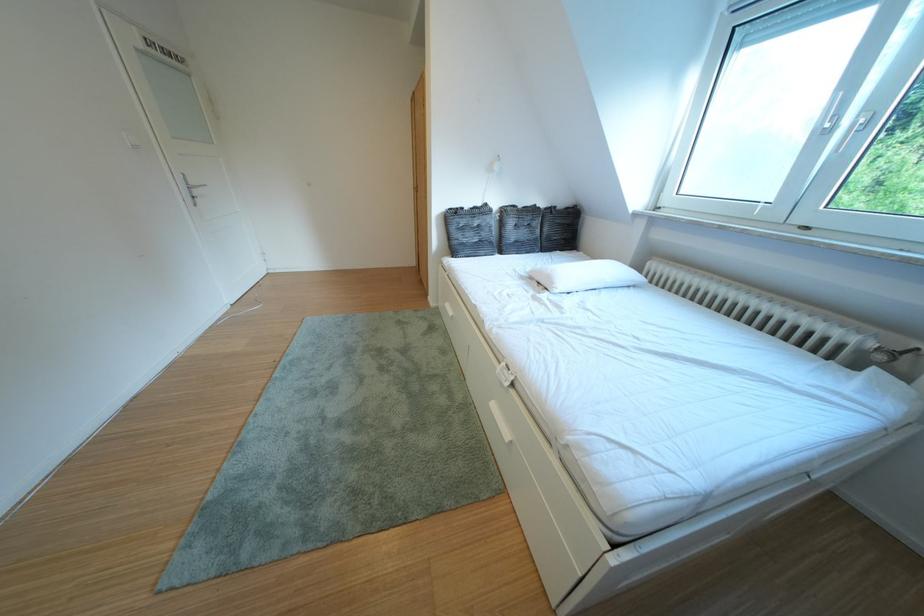
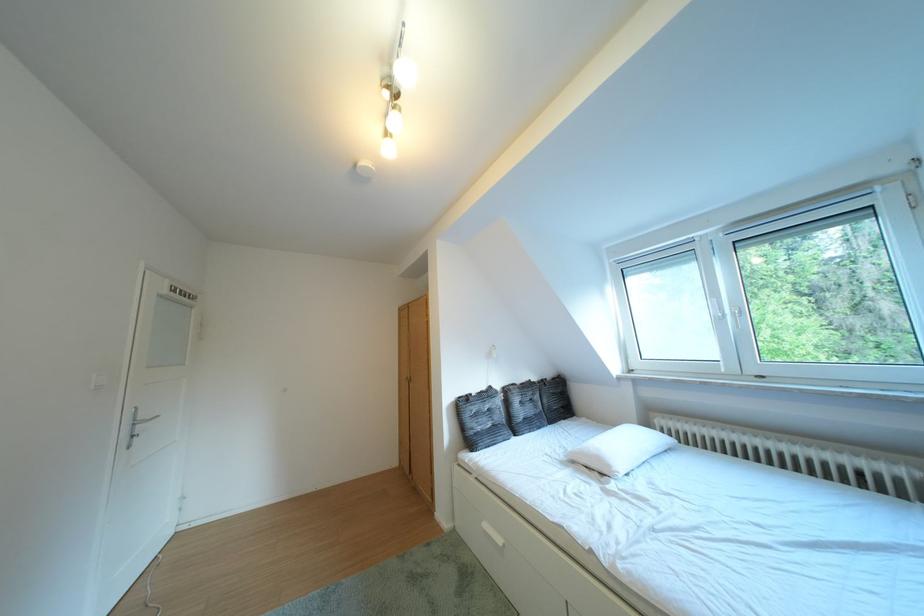
The point at (468, 246) is marked in the first image. Where is the corresponding point in the second image?

(484, 438)